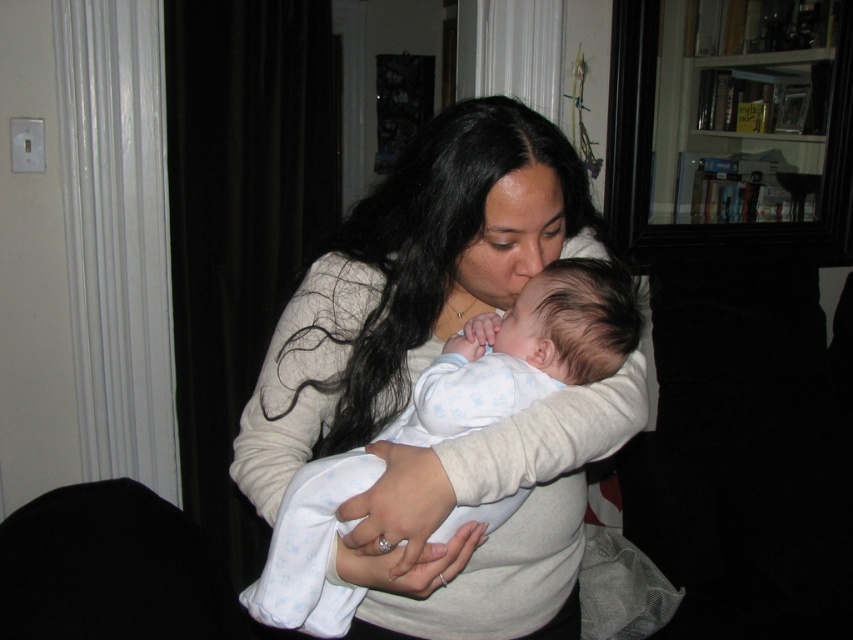
You are a photographer trying to capture a closeup of the white soft sweater at center and the white soft baby at center. Since you want both subjects to be in focus, which one should you focus on first to ensure proper depth of field?

The white soft sweater at center is larger in size than the white soft baby at center, so you should focus on the white soft sweater at center first to ensure both are in focus.

You are a photographer setting up for a family portrait. You want to ensure the white soft sweater at center is in focus while keeping the background slightly blurred. Based on the scene, what should the minimum focal length be to achieve this effect?

To achieve a blurred background with the white soft sweater at center in focus, the minimum focal length should be set to 85mm or higher, as the sweater is positioned 84.35 centimeters from the camera.

You are a photographer trying to capture a closeup shot of the white soft sweater at center and the white soft baby at center. You need to ensure that both subjects fit within the frame. Given that your camera has a fixed width, which subject requires more horizontal space to be fully captured?

The white soft sweater at center requires more horizontal space because its width surpasses that of the white soft baby at center.